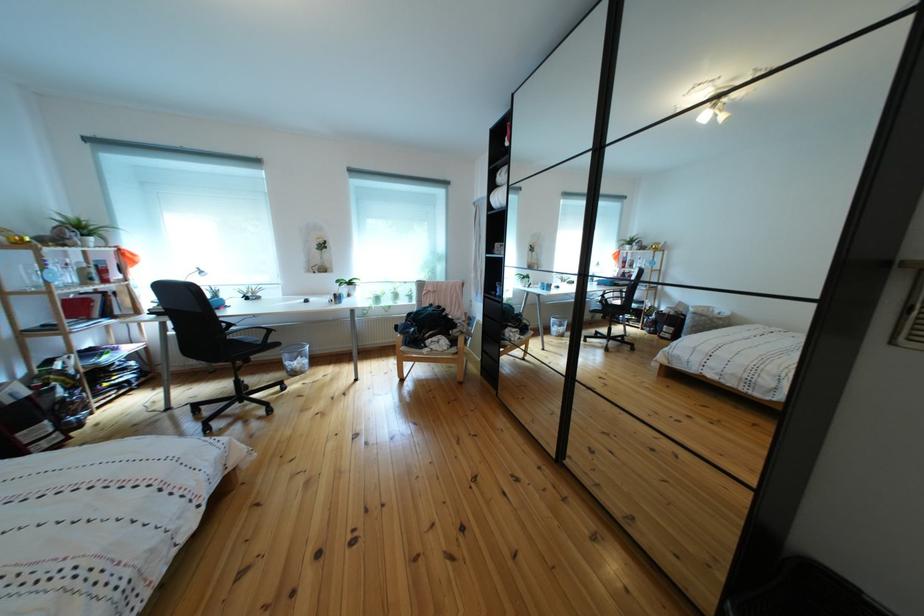
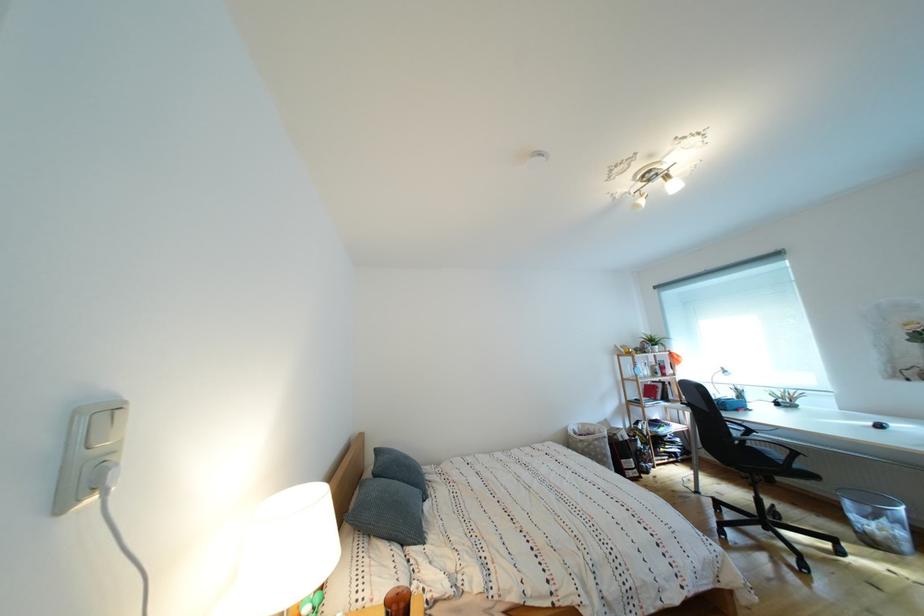
Find the pixel in the second image that matches [78,292] in the first image.

(657, 383)